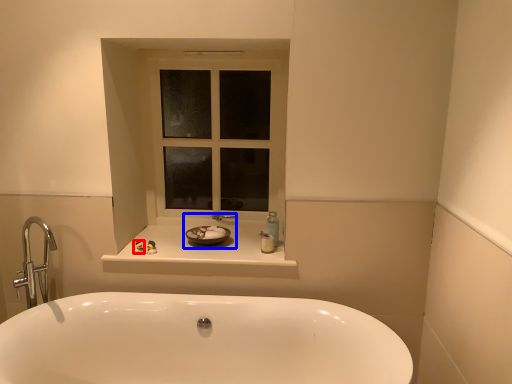
Question: Among these objects, which one is nearest to the camera, toiletry (highlighted by a red box) or sink (highlighted by a blue box)?

Choices:
 (A) toiletry
 (B) sink

Answer: (A)